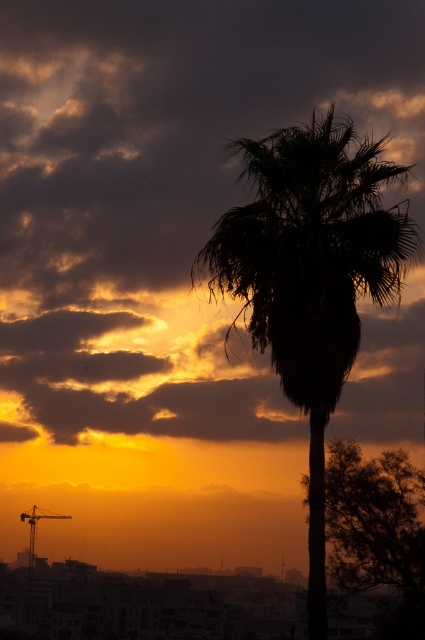
Question: Which point appears farthest from the camera in this image?

Choices:
 (A) (243, 401)
 (B) (288, 208)

Answer: (A)

Question: Which is nearer to the orange/yellow cloud at upper center?

Choices:
 (A) silhouette leafy palm at center
 (B) silky brown tree at center

Answer: (A)

Question: Is orange/yellow cloud at upper center smaller than silhouette leafy palm at center?

Choices:
 (A) no
 (B) yes

Answer: (A)

Question: Which of the following is the closest to the observer?

Choices:
 (A) silky brown tree at center
 (B) silhouette leafy palm at center

Answer: (B)

Question: Observing the image, what is the correct spatial positioning of orange/yellow cloud at upper center in reference to silhouette leafy palm at center?

Choices:
 (A) left
 (B) right

Answer: (A)

Question: Can you confirm if orange/yellow cloud at upper center is smaller than silhouette leafy palm at center?

Choices:
 (A) no
 (B) yes

Answer: (A)